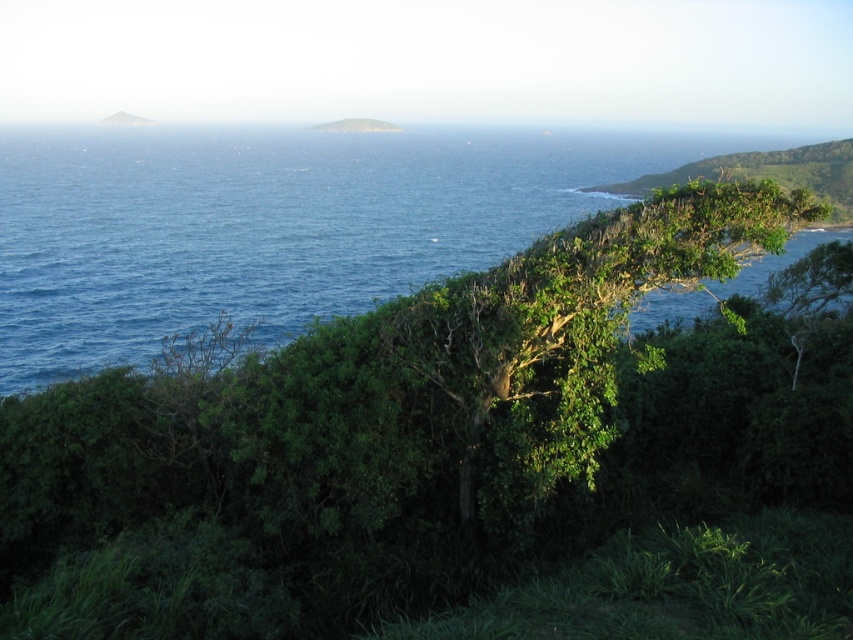
Does blue liquid water at upper left have a lesser width compared to green leafy hillside at upper left?

Incorrect, blue liquid water at upper left's width is not less than green leafy hillside at upper left's.

This screenshot has width=853, height=640. What do you see at coordinates (273, 225) in the screenshot? I see `blue liquid water at upper left` at bounding box center [273, 225].

Where is `blue liquid water at upper left`? blue liquid water at upper left is located at coordinates (x=273, y=225).

Consider the image. Is green leafy hillside at upper center smaller than green leafy hillside at upper left?

No.

You are a GUI agent. You are given a task and a screenshot of the screen. Output one action in this format:
    pyautogui.click(x=<x>, y=<y>)
    Task: Click on the green leafy hillside at upper center
    This screenshot has height=640, width=853.
    Given the screenshot: What is the action you would take?
    pyautogui.click(x=357, y=125)

You are a GUI agent. You are given a task and a screenshot of the screen. Output one action in this format:
    pyautogui.click(x=<x>, y=<y>)
    Task: Click on the green leafy hillside at upper center
    Image resolution: width=853 pixels, height=640 pixels.
    Given the screenshot: What is the action you would take?
    pyautogui.click(x=357, y=125)

Does green leafy tree at center appear over green leafy hillside at upper right?

No, green leafy tree at center is not above green leafy hillside at upper right.

The width and height of the screenshot is (853, 640). Describe the element at coordinates (419, 436) in the screenshot. I see `green leafy tree at center` at that location.

Find the location of a particular element. The width and height of the screenshot is (853, 640). green leafy tree at center is located at coordinates (419, 436).